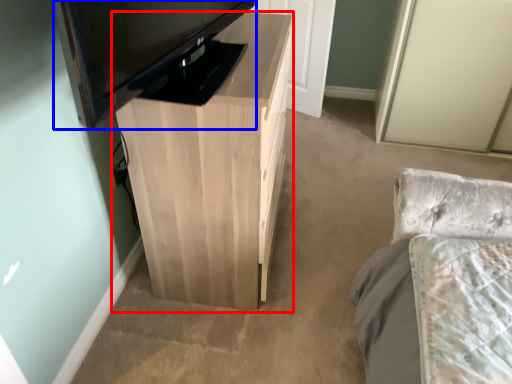
Question: Which point is further to the camera, table (highlighted by a red box) or television (highlighted by a blue box)?

Choices:
 (A) table
 (B) television

Answer: (A)